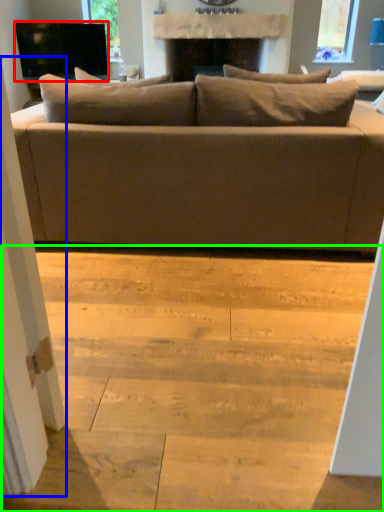
Question: Which is nearer to the television (highlighted by a red box)? screen door (highlighted by a blue box) or stair (highlighted by a green box).

Choices:
 (A) screen door
 (B) stair

Answer: (B)